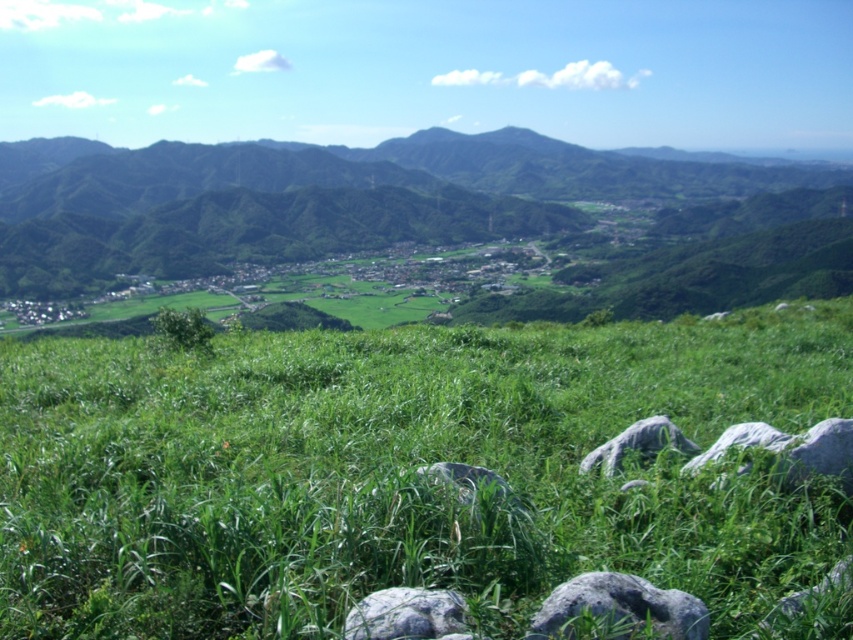
Question: Which point is closer to the camera?

Choices:
 (A) (432, 611)
 (B) (608, 577)
 (C) (616, 435)

Answer: (A)

Question: Can you confirm if gray rough rock at lower center is positioned to the left of gray rough stone at lower center?

Choices:
 (A) no
 (B) yes

Answer: (A)

Question: Does green grassy hill at center have a larger size compared to gray rough stone at center?

Choices:
 (A) no
 (B) yes

Answer: (B)

Question: Which is farther from the gray rough rock at lower center?

Choices:
 (A) green grassy hill at center
 (B) gray rough stone at center

Answer: (A)

Question: Estimate the real-world distances between objects in this image. Which object is closer to the green grassy at center?

Choices:
 (A) gray rough stone at lower center
 (B) gray rough stone at center
 (C) gray rough rock at lower center
 (D) green grassy hill at center

Answer: (A)

Question: Is green grassy at center above gray rough stone at lower center?

Choices:
 (A) yes
 (B) no

Answer: (A)